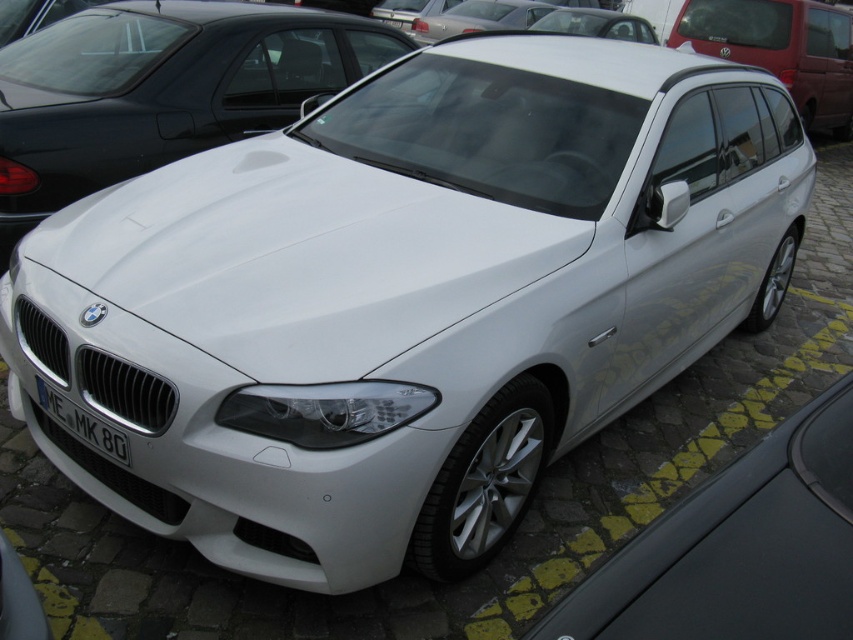
Question: Which object is closer to the camera taking this photo?

Choices:
 (A) white glossy car at center
 (B) white plastic license plate at center
 (C) white matte car at center

Answer: (C)

Question: From the image, what is the correct spatial relationship of white glossy car at upper right in relation to white plastic license plate at center?

Choices:
 (A) above
 (B) below

Answer: (A)

Question: Which point is closer to the camera?

Choices:
 (A) white matte car at center
 (B) white plastic license plate at center

Answer: (A)

Question: Which object is farther from the camera taking this photo?

Choices:
 (A) white glossy car at upper right
 (B) white glossy car at center

Answer: (A)

Question: Can you confirm if white glossy car at center is positioned to the left of white plastic license plate at center?

Choices:
 (A) no
 (B) yes

Answer: (B)

Question: Can you confirm if white glossy car at center is positioned to the right of white plastic license plate at center?

Choices:
 (A) no
 (B) yes

Answer: (A)